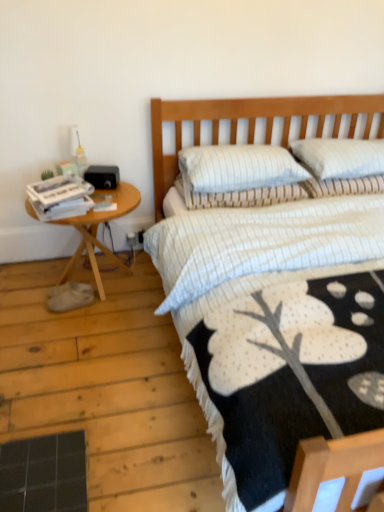
Question: Based on their sizes in the image, would you say white striped pillow at upper right, which appears as the 3th pillow when viewed from the left, is bigger or smaller than white paper magazines at left?

Choices:
 (A) big
 (B) small

Answer: (A)

Question: From the image's perspective, is white striped pillow at upper right, which appears as the 3th pillow when viewed from the left, above or below white paper magazines at left?

Choices:
 (A) above
 (B) below

Answer: (A)

Question: Considering the real-world distances, which object is farthest from the white striped fabric at center?

Choices:
 (A) white paper magazines at left
 (B) white striped pillow at center, the first pillow viewed from the left
 (C) woodenwoodenside table at left
 (D) white striped pillow at upper right, which is the first pillow in right-to-left order
 (E) white striped pillow at center, acting as the 2th pillow starting from the right

Answer: (A)

Question: Which is nearer to the white paper magazines at left?

Choices:
 (A) white striped fabric at center
 (B) white striped pillow at upper right, which appears as the 3th pillow when viewed from the left
 (C) woodenwoodenside table at left
 (D) white striped pillow at center, which is counted as the 2th pillow, starting from the left
 (E) white striped pillow at center, arranged as the third pillow when viewed from the right

Answer: (C)